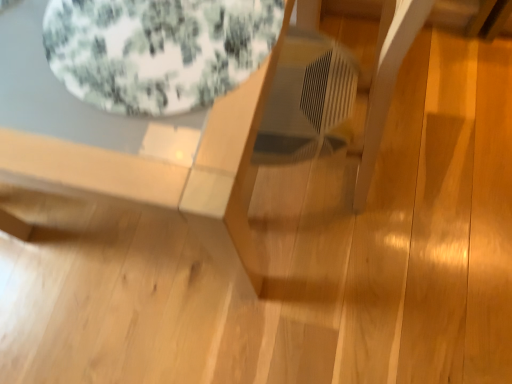
Question: Can you confirm if wooden table at center is smaller than floral fabric bean bag at upper left?

Choices:
 (A) no
 (B) yes

Answer: (A)

Question: Does wooden table at center have a lesser width compared to floral fabric bean bag at upper left?

Choices:
 (A) yes
 (B) no

Answer: (B)

Question: Are wooden table at center and floral fabric bean bag at upper left located far from each other?

Choices:
 (A) no
 (B) yes

Answer: (A)

Question: From a real-world perspective, is wooden table at center below floral fabric bean bag at upper left?

Choices:
 (A) yes
 (B) no

Answer: (A)

Question: Can we say wooden table at center lies outside floral fabric bean bag at upper left?

Choices:
 (A) yes
 (B) no

Answer: (A)

Question: Considering the relative sizes of wooden table at center and floral fabric bean bag at upper left in the image provided, is wooden table at center taller than floral fabric bean bag at upper left?

Choices:
 (A) no
 (B) yes

Answer: (B)

Question: Is floral fabric bean bag at upper left to the left of wooden table at center from the viewer's perspective?

Choices:
 (A) yes
 (B) no

Answer: (B)

Question: Is floral fabric bean bag at upper left smaller than wooden table at center?

Choices:
 (A) no
 (B) yes

Answer: (B)

Question: Is floral fabric bean bag at upper left facing away from wooden table at center?

Choices:
 (A) yes
 (B) no

Answer: (A)

Question: Is wooden table at center surrounded by floral fabric bean bag at upper left?

Choices:
 (A) no
 (B) yes

Answer: (A)

Question: Considering the relative sizes of floral fabric bean bag at upper left and wooden table at center in the image provided, is floral fabric bean bag at upper left taller than wooden table at center?

Choices:
 (A) yes
 (B) no

Answer: (B)

Question: Does floral fabric bean bag at upper left have a greater width compared to wooden table at center?

Choices:
 (A) no
 (B) yes

Answer: (A)

Question: Relative to wooden table at center, is floral fabric bean bag at upper left in front or behind?

Choices:
 (A) front
 (B) behind

Answer: (B)